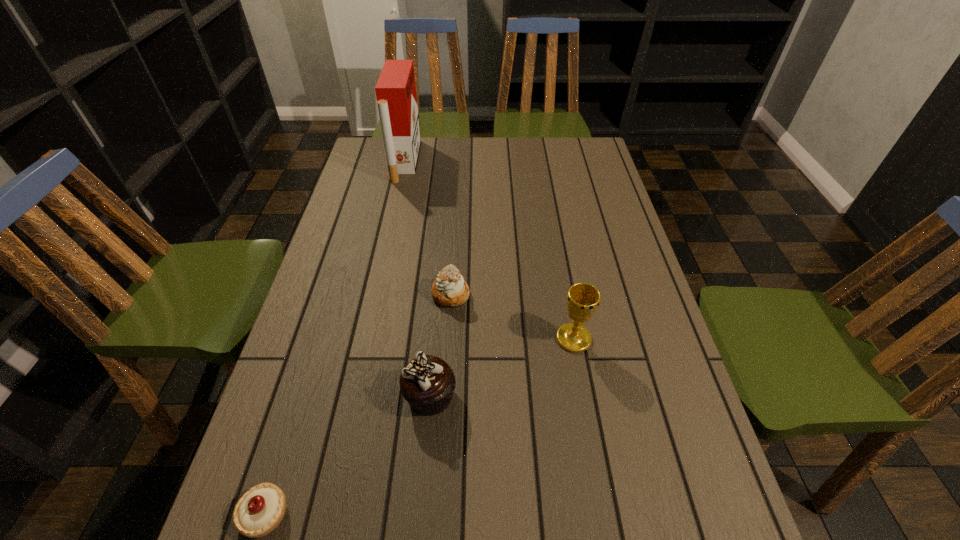
You are a GUI agent. You are given a task and a screenshot of the screen. Output one action in this format:
    pyautogui.click(x=<x>, y=<y>)
    Task: Click on the vacant area between the farthest object and the third farthest object
    
    Given the screenshot: What is the action you would take?
    pyautogui.click(x=490, y=249)

The width and height of the screenshot is (960, 540). I want to click on vacant region between the third tallest object and the fourth object from right to left, so click(x=418, y=278).

Where is `vacant point located between the tallest object and the rightmost object`? The height and width of the screenshot is (540, 960). vacant point located between the tallest object and the rightmost object is located at coordinates [490, 249].

This screenshot has width=960, height=540. Find the location of `free spot between the cupcake and the fourth tallest object`. free spot between the cupcake and the fourth tallest object is located at coordinates (441, 345).

Locate an element on the screen. Image resolution: width=960 pixels, height=540 pixels. the closest object relative to the second shortest object is located at coordinates (427, 383).

Identify which object is the fourth nearest to the cupcake. Please provide its 2D coordinates. Your answer should be formatted as a tuple, i.e. [(x, y)], where the tuple contains the x and y coordinates of a point satisfying the conditions above.

[(395, 90)]

Locate an element on the screen. free space that satisfies the following two spatial constraints: 1. on the back side of the third nearest object; 2. on the front-facing side of the farthest object is located at coordinates (541, 161).

The width and height of the screenshot is (960, 540). Find the location of `vacant area that satisfies the following two spatial constraints: 1. on the front-facing side of the tallest object; 2. on the left side of the rightmost object`. vacant area that satisfies the following two spatial constraints: 1. on the front-facing side of the tallest object; 2. on the left side of the rightmost object is located at coordinates (366, 339).